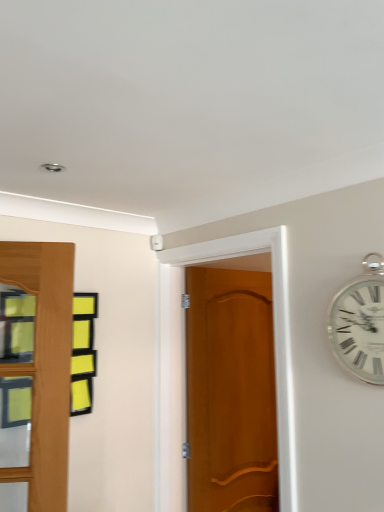
Question: From the image's perspective, would you say wooden door at center is positioned over silver metallic clock at upper right?

Choices:
 (A) no
 (B) yes

Answer: (A)

Question: Considering the relative sizes of wooden door at center and silver metallic clock at upper right in the image provided, is wooden door at center wider than silver metallic clock at upper right?

Choices:
 (A) no
 (B) yes

Answer: (B)

Question: From the image's perspective, does wooden door at center appear lower than silver metallic clock at upper right?

Choices:
 (A) no
 (B) yes

Answer: (B)

Question: Does wooden door at center have a larger size compared to silver metallic clock at upper right?

Choices:
 (A) yes
 (B) no

Answer: (A)

Question: Are wooden door at center and silver metallic clock at upper right located far from each other?

Choices:
 (A) no
 (B) yes

Answer: (A)

Question: From a real-world perspective, is wooden door at center positioned over silver metallic clock at upper right based on gravity?

Choices:
 (A) yes
 (B) no

Answer: (B)

Question: Does silver metallic clock at upper right have a greater width compared to wooden door at center?

Choices:
 (A) yes
 (B) no

Answer: (B)

Question: Can wooden door at center be found inside silver metallic clock at upper right?

Choices:
 (A) no
 (B) yes

Answer: (A)

Question: From the image's perspective, does silver metallic clock at upper right appear lower than wooden door at center?

Choices:
 (A) no
 (B) yes

Answer: (A)

Question: Does silver metallic clock at upper right come behind wooden door at center?

Choices:
 (A) no
 (B) yes

Answer: (A)

Question: Considering the relative positions of silver metallic clock at upper right and wooden door at center in the image provided, is silver metallic clock at upper right to the right of wooden door at center from the viewer's perspective?

Choices:
 (A) no
 (B) yes

Answer: (B)

Question: From a real-world perspective, is silver metallic clock at upper right located higher than wooden door at center?

Choices:
 (A) yes
 (B) no

Answer: (A)

Question: Considering the positions of silver metallic clock at upper right and wooden door at center in the image, is silver metallic clock at upper right wider or thinner than wooden door at center?

Choices:
 (A) wide
 (B) thin

Answer: (B)